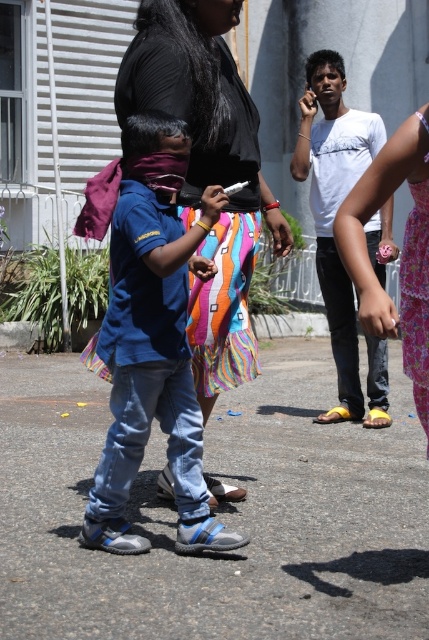
Based on the scene description, which object is positioned lower in the image between the blue denim jeans at center and the white matte shirt at center?

The blue denim jeans at center is positioned lower than the white matte shirt at center in the image.